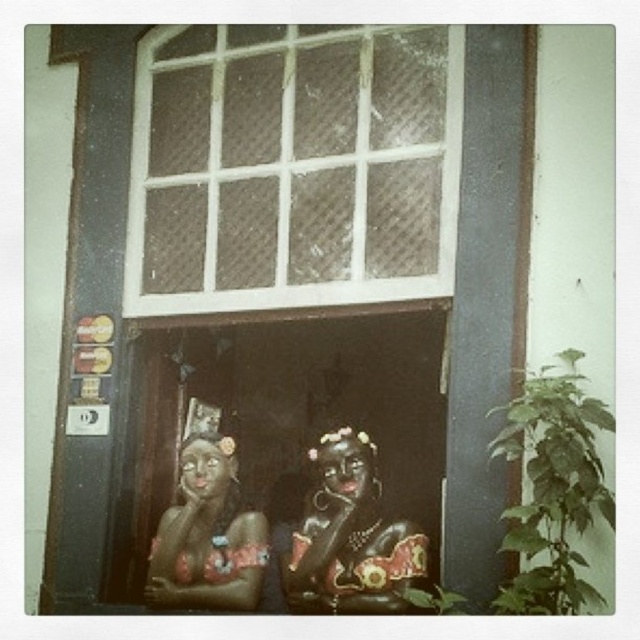
You are an interior designer planning to place a new decorative item between the black glossy statue at center and the matte ceramic statue at center. Based on their positions, where should you place the new item?

The black glossy statue at center is located above the matte ceramic statue at center, so placing the new item between them would require positioning it in the space below the black glossy statue at center and above the matte ceramic statue at center.

You are a painter standing 3 feet away from the matte ceramic statue at center. You want to paint the white mesh screen at upper center without moving. Can you reach it with your 5 foot long paintbrush?

The distance between the white mesh screen at upper center and matte ceramic statue at center is 4.83 feet. Since you are 3 feet away from the statue, the total distance to the screen is 7.83 feet. Your paintbrush is only 5 feet long, so you cannot reach the white mesh screen at upper center.

You are an interior designer planning to place a 60 cm wide decorative shelf between the black glossy statue at center and the matte ceramic statue at center. Based on the scene description, will the shelf fit between them without overlapping the statues?

The black glossy statue at center and matte ceramic statue at center are 59.12 centimeters apart. Since the shelf is 60 cm wide, it will not fit between them as the distance is slightly less than the shelf width. You may need to choose a narrower shelf or adjust their positions.